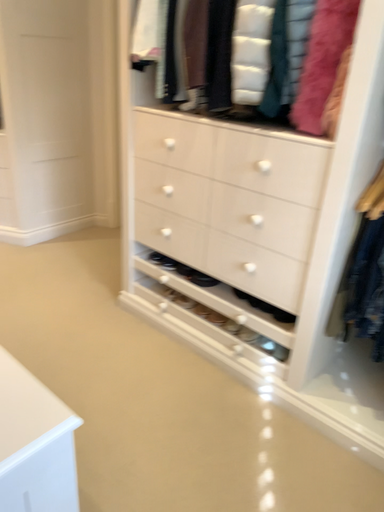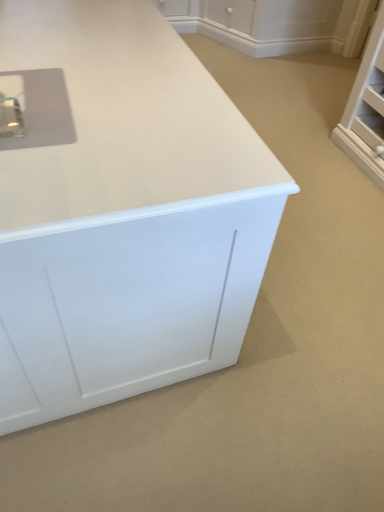
Question: Which way did the camera rotate in the video?

Choices:
 (A) rotated downward
 (B) rotated upward

Answer: (A)